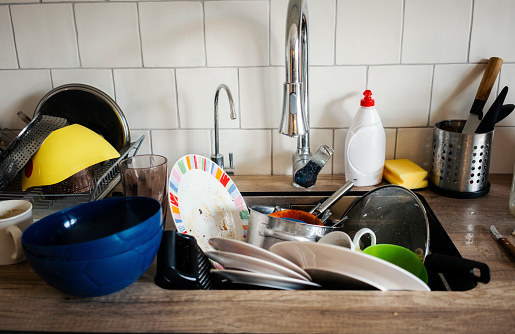
You are a GUI agent. You are given a task and a screenshot of the screen. Output one action in this format:
    pyautogui.click(x=<x>, y=<y>)
    Task: Click on the clean dishes
    Image resolution: width=515 pixels, height=334 pixels.
    Given the screenshot: What is the action you would take?
    pyautogui.click(x=112, y=118), pyautogui.click(x=52, y=126), pyautogui.click(x=66, y=158), pyautogui.click(x=79, y=186)